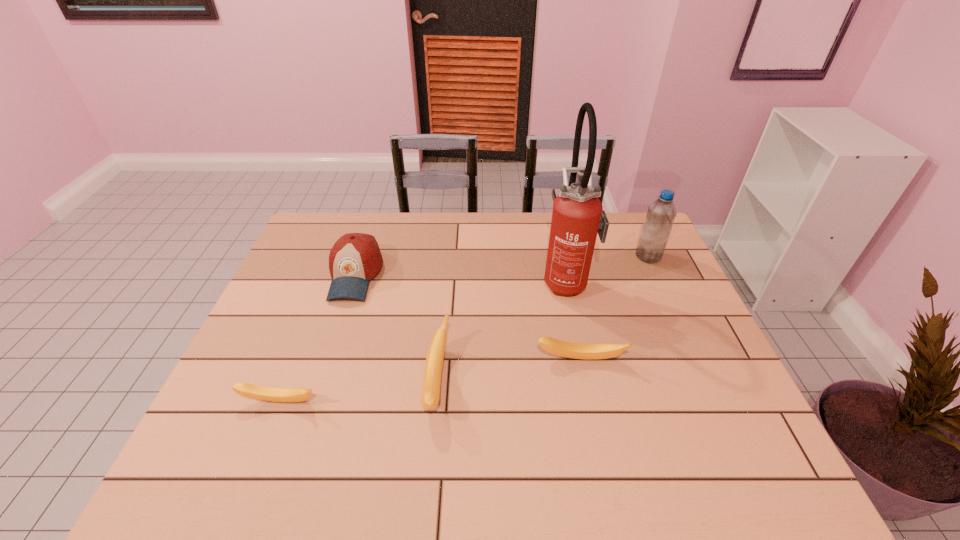
The height and width of the screenshot is (540, 960). I want to click on object positioned at the right edge, so click(661, 214).

I want to click on object located at the far left corner, so click(355, 258).

The height and width of the screenshot is (540, 960). I want to click on object positioned at the near left corner, so click(252, 391).

Find the location of a particular element. This screenshot has width=960, height=540. object that is at the far right corner is located at coordinates (661, 214).

This screenshot has width=960, height=540. In the image, there is a desktop. What are the coordinates of `free space at the far edge` in the screenshot? It's located at (400, 230).

At what (x,y) coordinates should I click in order to perform the action: click on blank area at the near edge. Please return your answer as a coordinate pair (x, y). The width and height of the screenshot is (960, 540). Looking at the image, I should click on pyautogui.click(x=371, y=401).

Find the location of `vacant space at the left edge of the desktop`. vacant space at the left edge of the desktop is located at coordinates (232, 384).

The height and width of the screenshot is (540, 960). In the image, there is a desktop. Find the location of `vacant space at the right edge`. vacant space at the right edge is located at coordinates (698, 396).

In the image, there is a desktop. Where is `vacant space at the far right corner`? vacant space at the far right corner is located at coordinates (621, 245).

You are a GUI agent. You are given a task and a screenshot of the screen. Output one action in this format:
    pyautogui.click(x=<x>, y=<y>)
    Task: Click on the free space that is in between the second tallest banana and the water bottle
    
    Given the screenshot: What is the action you would take?
    pos(614,308)